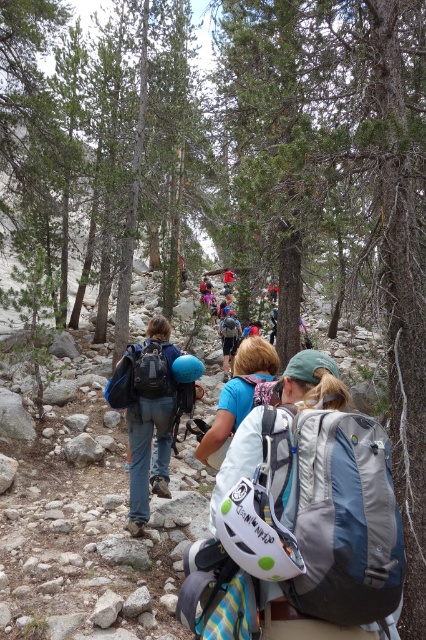
How distant is matte black backpack at center from matte blue helmet at center?

They are 8.02 meters apart.

Who is positioned more to the right, matte black backpack at center or matte blue helmet at center?

From the viewer's perspective, matte blue helmet at center appears more on the right side.

Is point (152, 387) more distant than point (222, 323)?

No, it is not.

Where is `matte black backpack at center`? matte black backpack at center is located at coordinates (152, 369).

Who is more forward, (291, 600) or (236, 344)?

Positioned in front is point (291, 600).

Who is lower down, gray fabric backpack at center or matte blue helmet at center?

Positioned lower is gray fabric backpack at center.

You are a GUI agent. You are given a task and a screenshot of the screen. Output one action in this format:
    pyautogui.click(x=<x>, y=<y>)
    Task: Click on the gray fabric backpack at center
    This screenshot has width=426, height=640.
    Given the screenshot: What is the action you would take?
    pyautogui.click(x=342, y=518)

At what (x,y) coordinates should I click in order to perform the action: click on gray fabric backpack at center. Please return your answer as a coordinate pair (x, y). The image size is (426, 640). Looking at the image, I should click on tap(342, 518).

How far apart are gray fabric backpack at center and matte blue backpack at center?

gray fabric backpack at center is 37.31 feet away from matte blue backpack at center.

Is gray fabric backpack at center wider than matte blue backpack at center?

No.

Which is in front, point (382, 448) or point (227, 330)?

Positioned in front is point (382, 448).

This screenshot has width=426, height=640. In order to click on gray fabric backpack at center in this screenshot , I will do `click(342, 518)`.